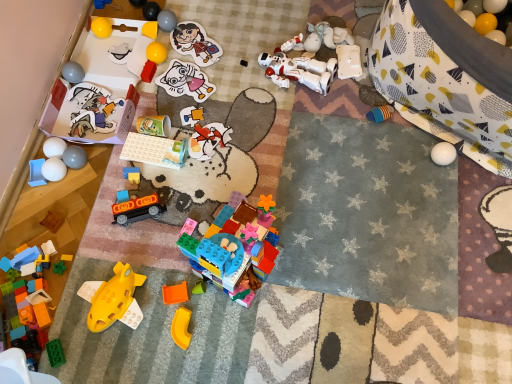
Identify the location of free area behind yellow rubber ball at upper left, positioned as the 11th toy in right-to-left order. Image resolution: width=512 pixels, height=384 pixels. (174, 31).